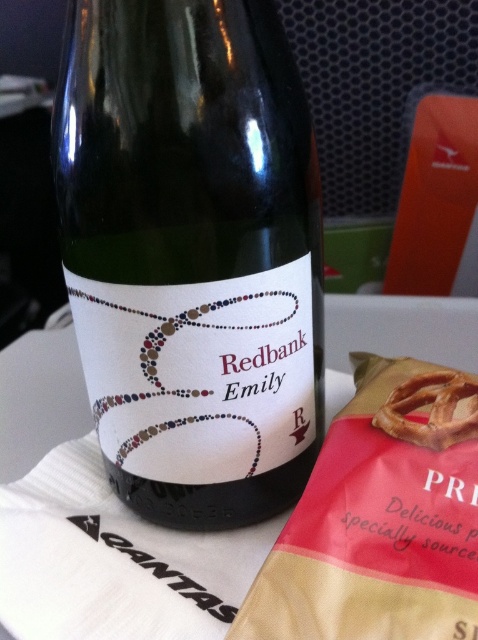
Can you confirm if green glass bottle at center is wider than golden brown pretzel at center?

Correct, the width of green glass bottle at center exceeds that of golden brown pretzel at center.

Locate an element on the screen. This screenshot has width=478, height=640. green glass bottle at center is located at coordinates (193, 253).

Identify the location of green glass bottle at center. Image resolution: width=478 pixels, height=640 pixels. (193, 253).